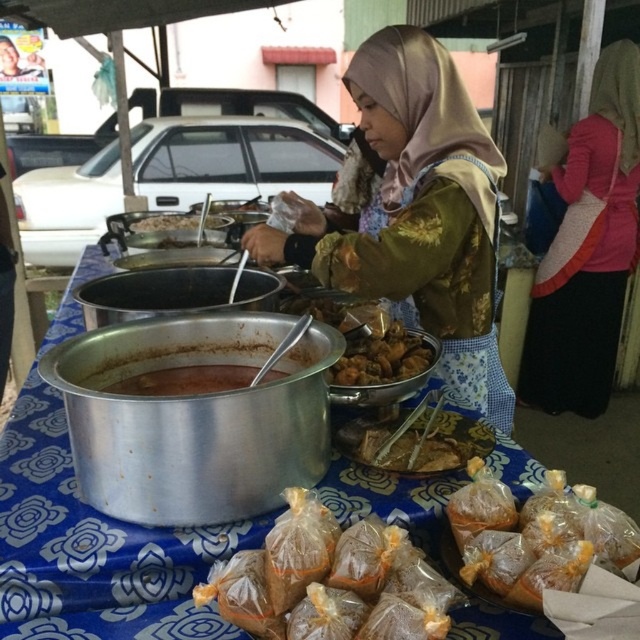
Which is behind, point (518, 531) or point (157, 385)?

The point (157, 385) is behind.

Between translucent plastic bag at lower center and brown matte soup at center, which one has more height?

With more height is translucent plastic bag at lower center.

Is point (448, 515) positioned after point (157, 371)?

No, (448, 515) is in front of (157, 371).

Identify the location of translucent plastic bag at lower center. The height and width of the screenshot is (640, 640). (532, 536).

Does translucent plastic bags at lower center appear on the left side of brown matte soup at center?

In fact, translucent plastic bags at lower center is to the right of brown matte soup at center.

Who is higher up, translucent plastic bags at lower center or brown matte soup at center?

brown matte soup at center is above.

Locate an element on the screen. translucent plastic bags at lower center is located at coordinates (330, 577).

Who is higher up, translucent plastic bag at lower center or shiny metallic bowl at center?

shiny metallic bowl at center

Does translucent plastic bag at lower center appear under shiny metallic bowl at center?

Yes.

Find the location of a particular element. translucent plastic bag at lower center is located at coordinates click(532, 536).

Find the location of `translucent plastic bag at lower center`. translucent plastic bag at lower center is located at coordinates (532, 536).